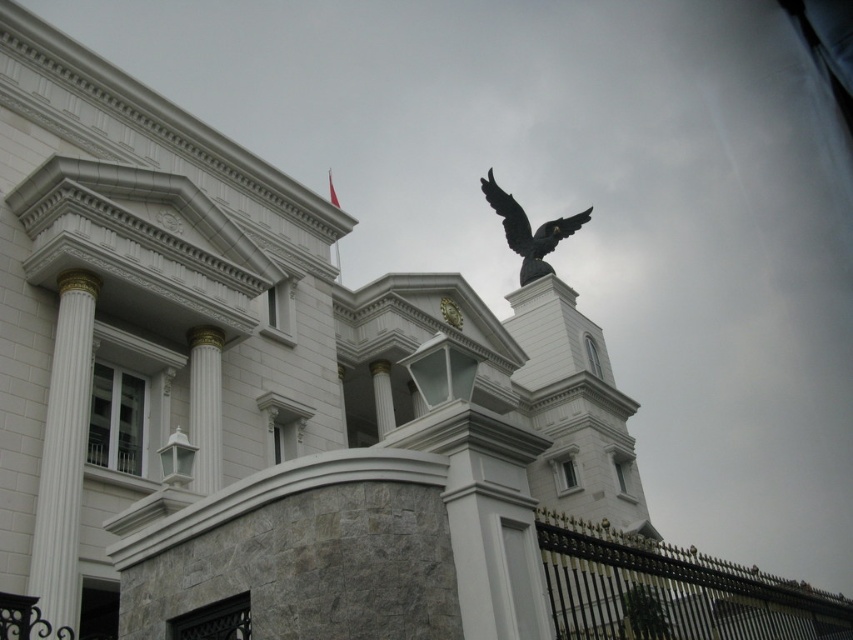
Question: Which point is closer to the camera?

Choices:
 (A) white marble column at left
 (B) white marble column at center

Answer: (A)

Question: Can you confirm if white marble column at left is positioned above shiny black eagle at upper center?

Choices:
 (A) yes
 (B) no

Answer: (B)

Question: Which point appears farthest from the camera in this image?

Choices:
 (A) (45, 422)
 (B) (192, 401)
 (C) (500, 216)

Answer: (C)

Question: Observing the image, what is the correct spatial positioning of white marble column at left in reference to shiny black eagle at upper center?

Choices:
 (A) left
 (B) right

Answer: (A)

Question: Is white marble column at left to the left of shiny black eagle at upper center from the viewer's perspective?

Choices:
 (A) no
 (B) yes

Answer: (B)

Question: Which of these objects is positioned closest to the white marble column at center?

Choices:
 (A) white marble column at left
 (B) shiny black eagle at upper center

Answer: (A)